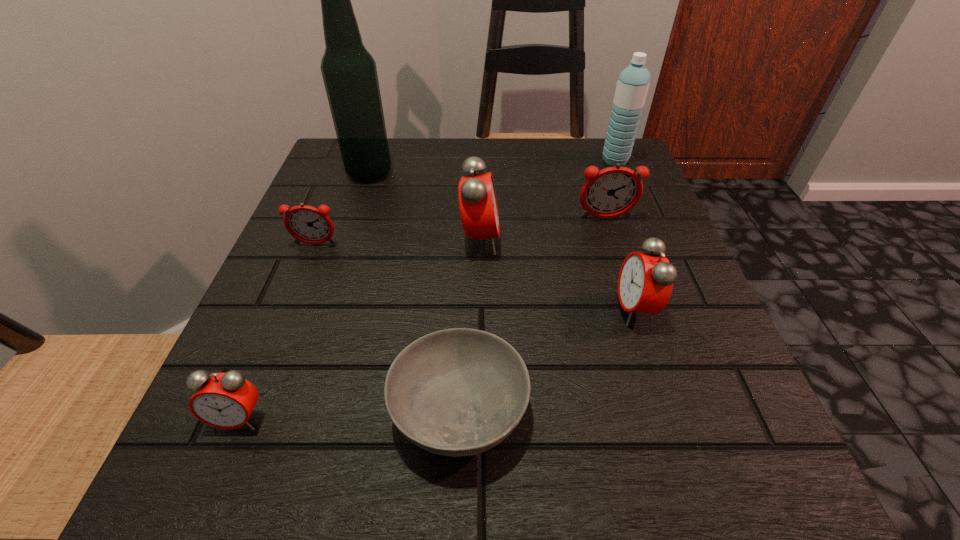
The height and width of the screenshot is (540, 960). What are the coordinates of `object that stands as the third closest to the blue water bottle` in the screenshot? It's located at (645, 283).

Where is `the closest alarm clock to the second red alarm clock from right to left`? The image size is (960, 540). the closest alarm clock to the second red alarm clock from right to left is located at coordinates [611, 192].

Select which alarm clock is the third closest to the tallest object. Please provide its 2D coordinates. Your answer should be formatted as a tuple, i.e. [(x, y)], where the tuple contains the x and y coordinates of a point satisfying the conditions above.

[(611, 192)]

Where is `red alarm clock that stands as the closest to the bigger reddish-pink alarm clock`? The height and width of the screenshot is (540, 960). red alarm clock that stands as the closest to the bigger reddish-pink alarm clock is located at coordinates (478, 207).

Locate an element on the screen. red alarm clock that is the closest to the nearer reddish-pink alarm clock is located at coordinates (478, 207).

Where is `free space that satisfies the following two spatial constraints: 1. on the front-facing side of the second nearest red alarm clock; 2. on the front side of the shortest object`? The height and width of the screenshot is (540, 960). free space that satisfies the following two spatial constraints: 1. on the front-facing side of the second nearest red alarm clock; 2. on the front side of the shortest object is located at coordinates (668, 410).

Where is `vacant space that satisfies the following two spatial constraints: 1. on the front-facing side of the biggest red alarm clock; 2. on the front-facing side of the nearer reddish-pink alarm clock`? vacant space that satisfies the following two spatial constraints: 1. on the front-facing side of the biggest red alarm clock; 2. on the front-facing side of the nearer reddish-pink alarm clock is located at coordinates (480, 244).